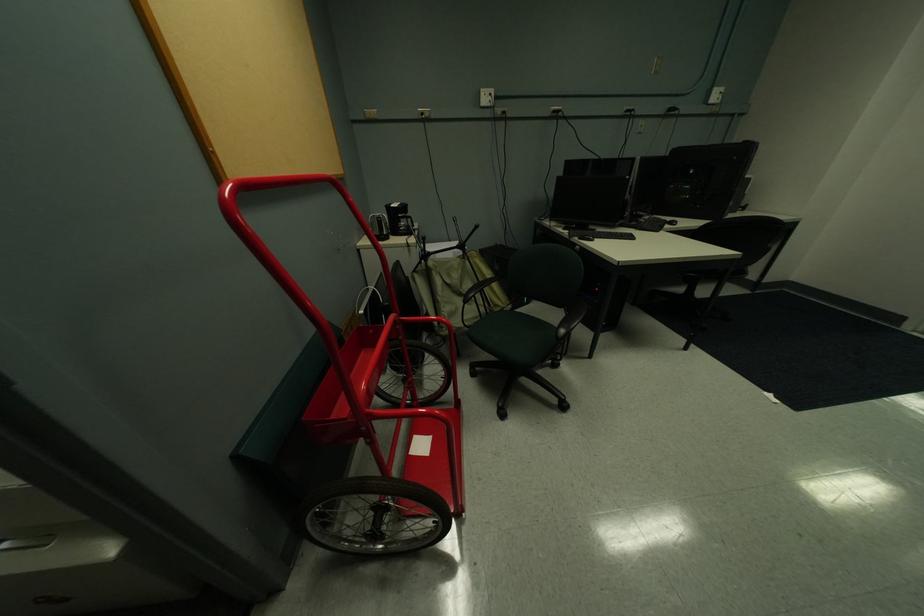
Find the location of a particular element. The width and height of the screenshot is (924, 616). green chair sitting surface is located at coordinates (511, 333).